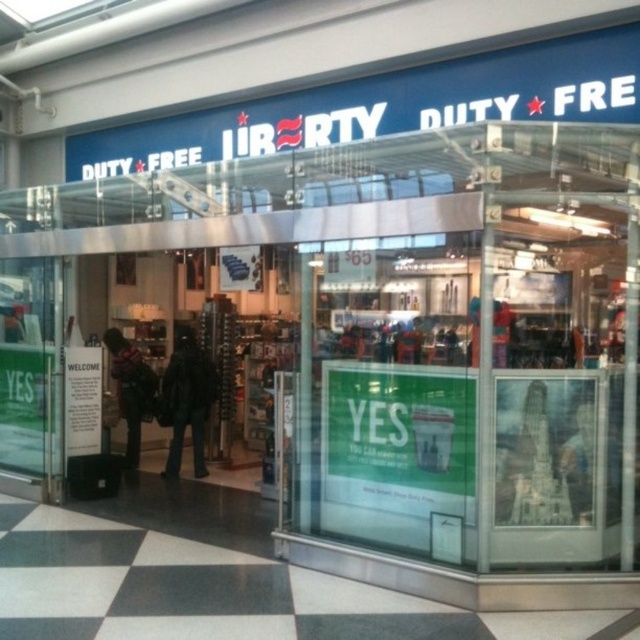
You are standing outside the Liberty Duty Free store and see the entrance. There is a point at coordinate (x=186, y=400). What object is located at that point?

The point at coordinate (x=186, y=400) corresponds to the black fuzzy coat at center.

Looking at this image, you are a customer carrying a black fuzzy coat at center and want to enter the Liberty Duty Free store through the transparent glass door at left. Will the coat fit through the door without needing to be folded or adjusted?

The transparent glass door at left is wider than the black fuzzy coat at center, so the coat will fit through the door without needing to be folded or adjusted.